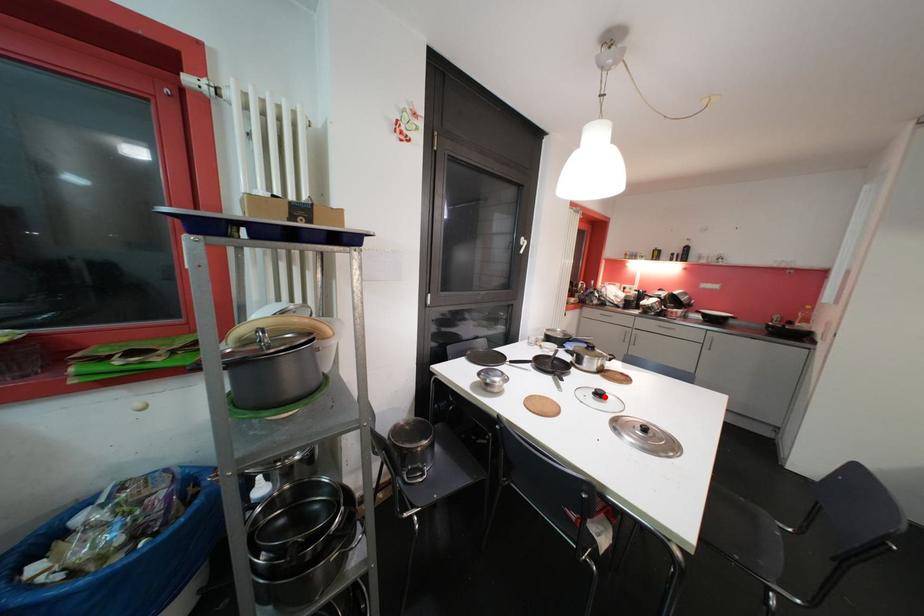
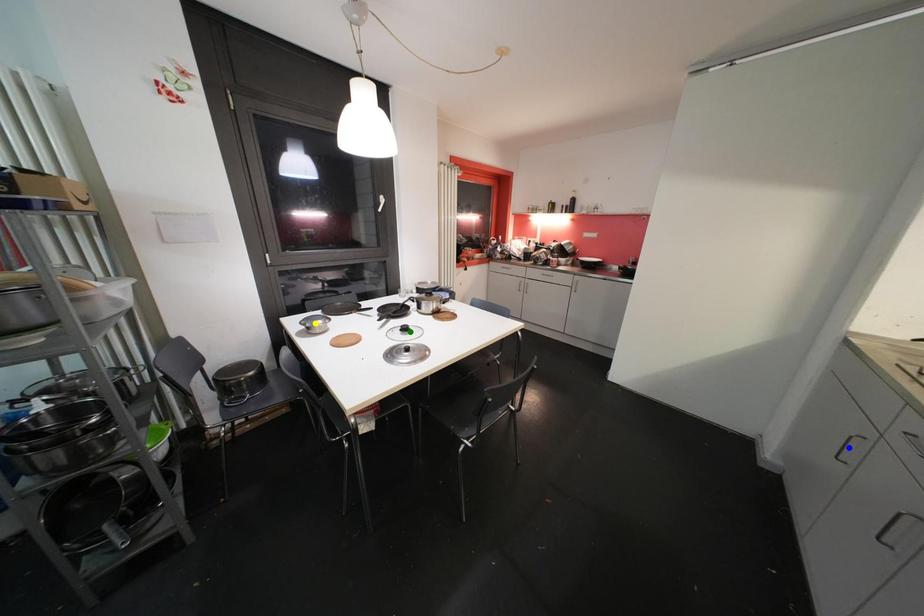
Question: I am providing you with two images of the same scene from different viewpoints. A red point is marked on the first image. You are given multiple points on the second image. Which mark in image 2 goes with the point in image 1?

Choices:
 (A) green point
 (B) blue point
 (C) yellow point

Answer: (A)